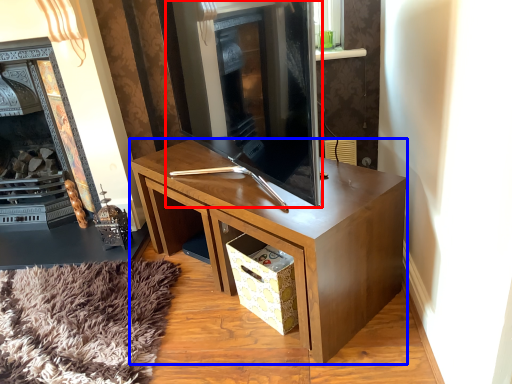
Question: Which of the following is the farthest to the observer, fireplace (highlighted by a red box) or desk (highlighted by a blue box)?

Choices:
 (A) fireplace
 (B) desk

Answer: (B)